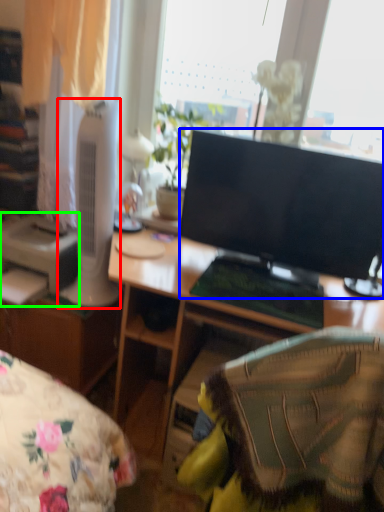
Question: Considering the real-world distances, which object is farthest from home appliance (highlighted by a red box)? television (highlighted by a blue box) or printer (highlighted by a green box)?

Choices:
 (A) television
 (B) printer

Answer: (A)